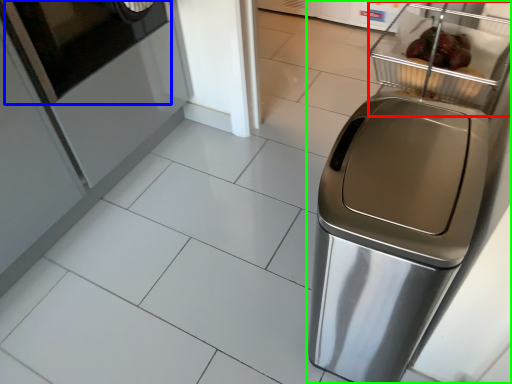
Question: Estimate the real-world distances between objects in this image. Which object is closer to basket (highlighted by a red box), screen door (highlighted by a blue box) or home appliance (highlighted by a green box)?

Choices:
 (A) screen door
 (B) home appliance

Answer: (B)